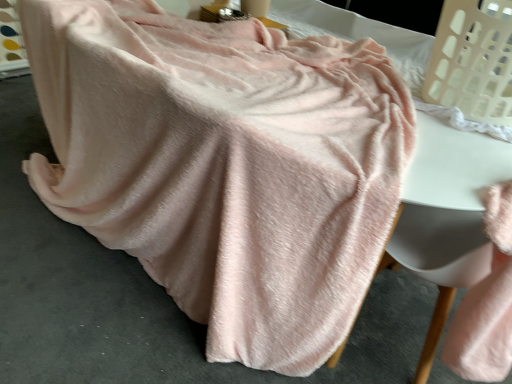
Question: Considering the positions of soft pink fabric at lower right and white plastic laundry basket at upper right in the image, is soft pink fabric at lower right wider or thinner than white plastic laundry basket at upper right?

Choices:
 (A) wide
 (B) thin

Answer: (B)

Question: Is point (412, 225) closer or farther from the camera than point (472, 104)?

Choices:
 (A) closer
 (B) farther

Answer: (B)

Question: From a real-world perspective, is soft pink fabric at lower right above or below white plastic laundry basket at upper right?

Choices:
 (A) below
 (B) above

Answer: (A)

Question: From a real-world perspective, is white plastic laundry basket at upper right positioned above or below soft pink fabric at lower right?

Choices:
 (A) above
 (B) below

Answer: (A)

Question: Is white plastic laundry basket at upper right taller or shorter than soft pink fabric at lower right?

Choices:
 (A) short
 (B) tall

Answer: (A)

Question: From the image's perspective, relative to soft pink fabric at lower right, is white plastic laundry basket at upper right above or below?

Choices:
 (A) below
 (B) above

Answer: (B)

Question: Considering the positions of white plastic laundry basket at upper right and soft pink fabric at lower right in the image, is white plastic laundry basket at upper right wider or thinner than soft pink fabric at lower right?

Choices:
 (A) wide
 (B) thin

Answer: (A)